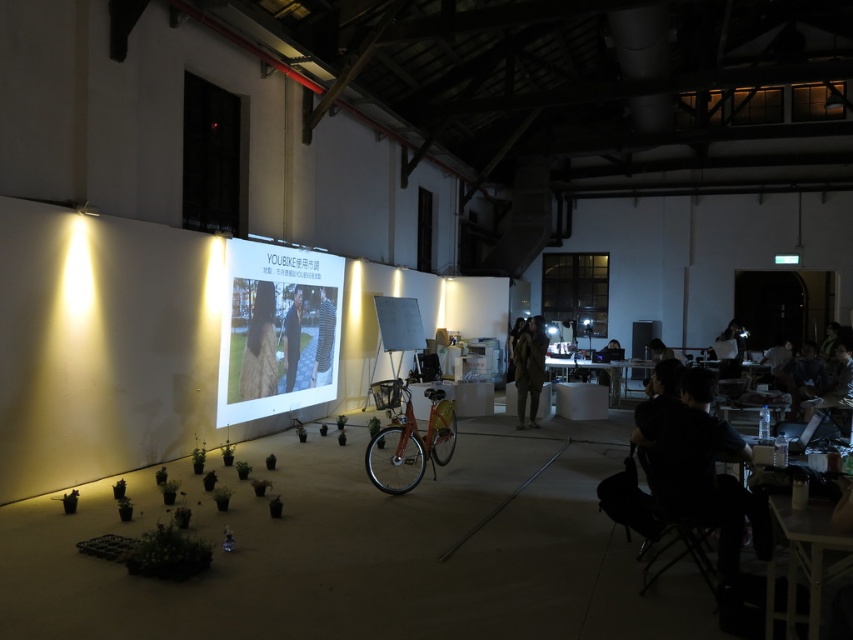
Between black fabric chair at lower right and long brown hair at center, which one appears on the left side from the viewer's perspective?

From the viewer's perspective, long brown hair at center appears more on the left side.

Can you confirm if black fabric chair at lower right is wider than long brown hair at center?

Yes, black fabric chair at lower right is wider than long brown hair at center.

Describe the element at coordinates (701, 467) in the screenshot. Image resolution: width=853 pixels, height=640 pixels. I see `black fabric chair at lower right` at that location.

Where is `black fabric chair at lower right`? Image resolution: width=853 pixels, height=640 pixels. black fabric chair at lower right is located at coordinates (701, 467).

Who is higher up, dark brown leather jacket at center or matte black laptop at lower right?

dark brown leather jacket at center

Does dark brown leather jacket at center appear under matte black laptop at lower right?

No, dark brown leather jacket at center is not below matte black laptop at lower right.

The height and width of the screenshot is (640, 853). What do you see at coordinates (529, 369) in the screenshot?
I see `dark brown leather jacket at center` at bounding box center [529, 369].

Locate an element on the screen. This screenshot has height=640, width=853. dark brown leather jacket at center is located at coordinates (529, 369).

Can you confirm if black fabric chair at lower right is taller than dark blue shirt at center?

In fact, black fabric chair at lower right may be shorter than dark blue shirt at center.

Between black fabric chair at lower right and dark blue shirt at center, which one appears on the right side from the viewer's perspective?

From the viewer's perspective, black fabric chair at lower right appears more on the right side.

Is point (709, 404) positioned after point (297, 316)?

No, it is not.

Where is `black fabric chair at lower right`? The image size is (853, 640). black fabric chair at lower right is located at coordinates (701, 467).